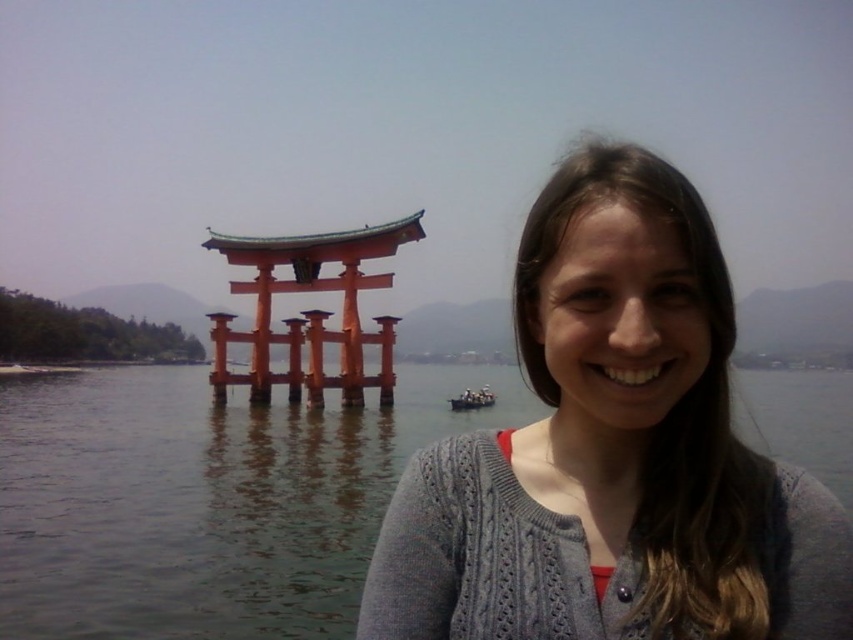
Question: Is transparent water at center thinner than wooden boat at center?

Choices:
 (A) no
 (B) yes

Answer: (A)

Question: Can you confirm if transparent water at center is bigger than wooden boat at center?

Choices:
 (A) yes
 (B) no

Answer: (A)

Question: Can you confirm if gray knitted sweater at center is thinner than transparent water at center?

Choices:
 (A) yes
 (B) no

Answer: (A)

Question: Which point appears farthest from the camera in this image?

Choices:
 (A) (491, 401)
 (B) (196, 632)

Answer: (A)

Question: Which of these objects is positioned closest to the wooden boat at center?

Choices:
 (A) gray knitted sweater at center
 (B) transparent water at center

Answer: (B)

Question: Which point appears closest to the camera in this image?

Choices:
 (A) (498, 522)
 (B) (338, 536)
 (C) (460, 404)

Answer: (A)